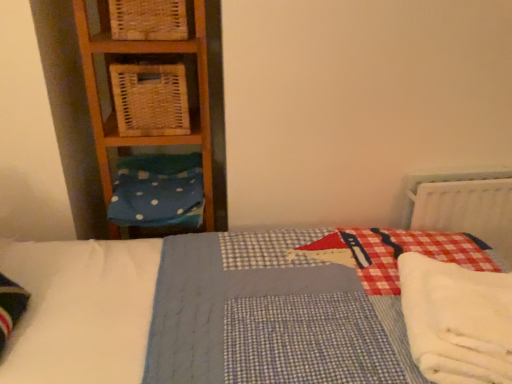
Question: In terms of height, does white fluffy blanket at lower right look taller or shorter compared to woven wood basket at left, the second crate in the top-to-bottom sequence?

Choices:
 (A) short
 (B) tall

Answer: (A)

Question: Is white fluffy blanket at lower right wider or thinner than woven wood basket at left, the second crate in the top-to-bottom sequence?

Choices:
 (A) thin
 (B) wide

Answer: (B)

Question: Based on their relative distances, which object is farther from the blue polka dot fabric at left?

Choices:
 (A) white fluffy blanket at lower right
 (B) woven wood crate at upper left, arranged as the 2th crate when ordered from the bottom
 (C) woven wood basket at left, the 1th crate in the bottom-to-top sequence

Answer: (A)

Question: Which object is positioned closest to the white fluffy blanket at lower right?

Choices:
 (A) blue polka dot fabric at left
 (B) woven wood basket at left, the second crate in the top-to-bottom sequence
 (C) woven wood crate at upper left, arranged as the 2th crate when ordered from the bottom

Answer: (A)